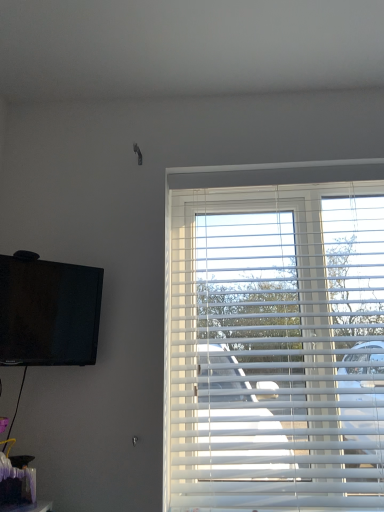
The height and width of the screenshot is (512, 384). Identify the location of white plastic blinds at right. (275, 346).

What do you see at coordinates (275, 346) in the screenshot?
I see `white plastic blinds at right` at bounding box center [275, 346].

In order to face matte black tv at upper left, should I rotate leftwards or rightwards?

It's best to rotate left around 18.626 degrees.

The width and height of the screenshot is (384, 512). Find the location of `matte black tv at upper left`. matte black tv at upper left is located at coordinates (48, 313).

Describe the element at coordinates (48, 313) in the screenshot. This screenshot has height=512, width=384. I see `matte black tv at upper left` at that location.

At what (x,y) coordinates should I click in order to perform the action: click on white plastic blinds at right. Please return your answer as a coordinate pair (x, y). The image size is (384, 512). Looking at the image, I should click on (275, 346).

Which is more to the right, white plastic blinds at right or matte black tv at upper left?

white plastic blinds at right.

Does white plastic blinds at right lie behind matte black tv at upper left?

That is True.

Between point (356, 330) and point (35, 329), which one is positioned in front?

The point (35, 329) is closer.

From the image's perspective, is white plastic blinds at right positioned above or below matte black tv at upper left?

white plastic blinds at right is situated lower than matte black tv at upper left in the image.

From a real-world perspective, which object stands above the other?

In real-world perspective, matte black tv at upper left is above.

Which object is wider, white plastic blinds at right or matte black tv at upper left?

With larger width is white plastic blinds at right.

Considering the sizes of white plastic blinds at right and matte black tv at upper left in the image, is white plastic blinds at right taller or shorter than matte black tv at upper left?

In the image, white plastic blinds at right appears to be taller than matte black tv at upper left.

Between white plastic blinds at right and matte black tv at upper left, which one has smaller size?

With smaller size is matte black tv at upper left.

Consider the image. Can matte black tv at upper left be found inside white plastic blinds at right?

No, matte black tv at upper left is not inside white plastic blinds at right.

Is white plastic blinds at right next to matte black tv at upper left?

No, white plastic blinds at right is not in contact with matte black tv at upper left.

Is white plastic blinds at right facing away from matte black tv at upper left?

white plastic blinds at right does not have its back to matte black tv at upper left.

What's the angular difference between white plastic blinds at right and matte black tv at upper left's facing directions?

41.6 degrees separate the facing orientations of white plastic blinds at right and matte black tv at upper left.

Locate an element on the screen. window blind lying on the right of matte black tv at upper left is located at coordinates (275, 346).

Is matte black tv at upper left to the left or to the right of white plastic blinds at right in the image?

Clearly, matte black tv at upper left is on the left of white plastic blinds at right in the image.

Which object is closer to the camera taking this photo, matte black tv at upper left or white plastic blinds at right?

matte black tv at upper left is closer to the camera.

Which point is more distant from viewer, (16, 333) or (366, 181)?

The point (366, 181) is farther from the camera.

From the image's perspective, is matte black tv at upper left below white plastic blinds at right?

Incorrect, from the image's perspective, matte black tv at upper left is higher than white plastic blinds at right.

From a real-world perspective, is matte black tv at upper left located higher than white plastic blinds at right?

Yes, from a real-world perspective, matte black tv at upper left is on top of white plastic blinds at right.

Between matte black tv at upper left and white plastic blinds at right, which one has smaller width?

matte black tv at upper left is thinner.

Which of these two, matte black tv at upper left or white plastic blinds at right, stands shorter?

matte black tv at upper left is shorter.

Who is smaller, matte black tv at upper left or white plastic blinds at right?

matte black tv at upper left is smaller.

Could white plastic blinds at right be considered to be inside matte black tv at upper left?

That's incorrect, white plastic blinds at right is not inside matte black tv at upper left.

Is matte black tv at upper left next to white plastic blinds at right?

There is a gap between matte black tv at upper left and white plastic blinds at right.

Could you tell me if matte black tv at upper left is turned towards white plastic blinds at right?

No, matte black tv at upper left is not aimed at white plastic blinds at right.

What's the angular difference between matte black tv at upper left and white plastic blinds at right's facing directions?

The angle between the facing direction of matte black tv at upper left and the facing direction of white plastic blinds at right is 41.6 degrees.

Measure the distance from matte black tv at upper left to white plastic blinds at right.

They are 23.92 inches apart.

Image resolution: width=384 pixels, height=512 pixels. Identify the location of window blind below the matte black tv at upper left (from a real-world perspective). (275, 346).

Where is `window blind to the right of matte black tv at upper left`? window blind to the right of matte black tv at upper left is located at coordinates (275, 346).

You are a GUI agent. You are given a task and a screenshot of the screen. Output one action in this format:
    pyautogui.click(x=<x>, y=<y>)
    Task: Click on the television in front of the white plastic blinds at right
    The image size is (384, 512).
    Given the screenshot: What is the action you would take?
    pyautogui.click(x=48, y=313)